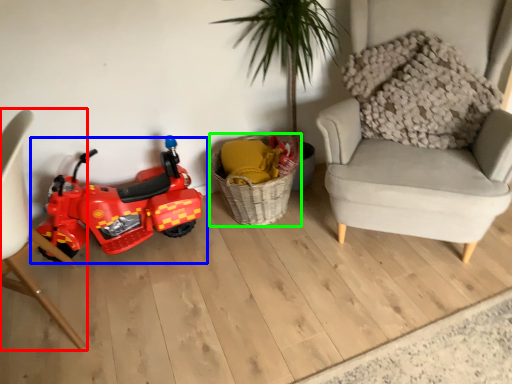
Question: Estimate the real-world distances between objects in this image. Which object is closer to chair (highlighted by a red box), land vehicle (highlighted by a blue box) or basket (highlighted by a green box)?

Choices:
 (A) land vehicle
 (B) basket

Answer: (A)